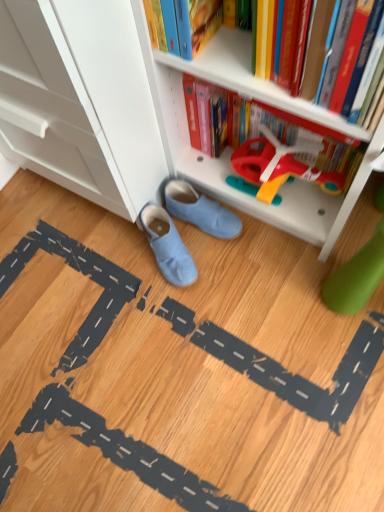
The height and width of the screenshot is (512, 384). What are the coordinates of `vacant space to the right of light blue suede shoes at center, which appears as the second footwear when viewed from the top` in the screenshot? It's located at (241, 260).